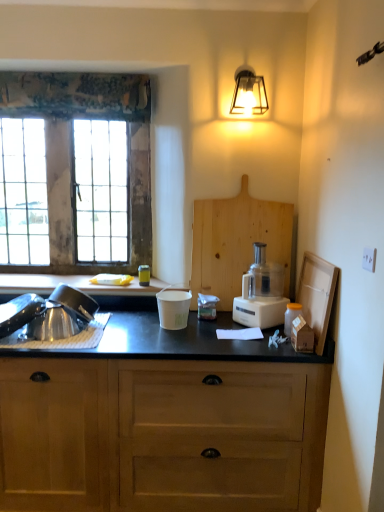
Question: From a real-world perspective, is white plastic food processor at center-right under wooden cabinet at lower center?

Choices:
 (A) no
 (B) yes

Answer: (A)

Question: Can you confirm if white plastic food processor at center-right is positioned to the right of wooden cabinet at lower center?

Choices:
 (A) no
 (B) yes

Answer: (B)

Question: Does white plastic food processor at center-right have a greater height compared to wooden cabinet at lower center?

Choices:
 (A) no
 (B) yes

Answer: (A)

Question: From a real-world perspective, is white plastic food processor at center-right physically above wooden cabinet at lower center?

Choices:
 (A) no
 (B) yes

Answer: (B)

Question: Are white plastic food processor at center-right and wooden cabinet at lower center beside each other?

Choices:
 (A) yes
 (B) no

Answer: (B)

Question: Which is correct: wooden cabinet at lower center is inside cardboard box at right, or outside of it?

Choices:
 (A) outside
 (B) inside

Answer: (A)

Question: Considering the positions of wooden cabinet at lower center and cardboard box at right in the image, is wooden cabinet at lower center taller or shorter than cardboard box at right?

Choices:
 (A) tall
 (B) short

Answer: (A)

Question: From a real-world perspective, is wooden cabinet at lower center physically located above or below cardboard box at right?

Choices:
 (A) above
 (B) below

Answer: (B)

Question: Considering the positions of wooden cabinet at lower center and cardboard box at right in the image, is wooden cabinet at lower center bigger or smaller than cardboard box at right?

Choices:
 (A) big
 (B) small

Answer: (A)

Question: Is white plastic food processor at center-right bigger or smaller than black matte countertop at left?

Choices:
 (A) small
 (B) big

Answer: (B)

Question: Is point (281, 271) positioned closer to the camera than point (44, 287)?

Choices:
 (A) closer
 (B) farther

Answer: (A)

Question: From a real-world perspective, is white plastic food processor at center-right positioned above or below black matte countertop at left?

Choices:
 (A) above
 (B) below

Answer: (A)

Question: Considering the relative positions of white plastic food processor at center-right and black matte countertop at left in the image provided, is white plastic food processor at center-right to the left or to the right of black matte countertop at left?

Choices:
 (A) right
 (B) left

Answer: (A)

Question: Is wooden cabinet at lower center in front of or behind brushed metal sink at lower left in the image?

Choices:
 (A) behind
 (B) front

Answer: (B)

Question: Based on their positions, is wooden cabinet at lower center located to the left or right of brushed metal sink at lower left?

Choices:
 (A) left
 (B) right

Answer: (B)